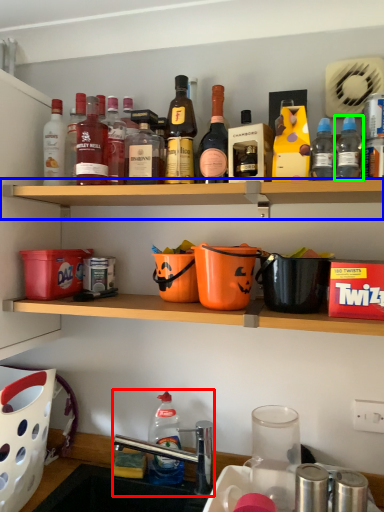
Question: Based on their relative distances, which object is nearer to sink (highlighted by a red box)? Choose from shelf (highlighted by a blue box) and bottle (highlighted by a green box).

Choices:
 (A) shelf
 (B) bottle

Answer: (A)